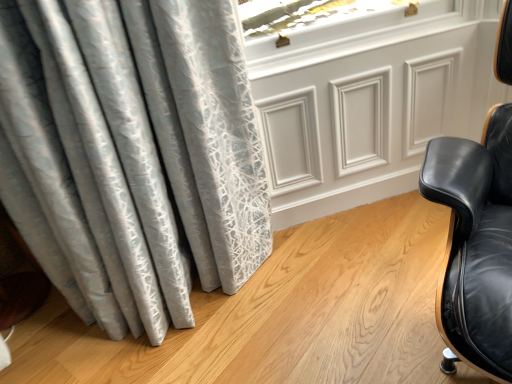
Find the location of a particular element. This screenshot has width=512, height=384. free point above white glossy panel at upper center (from a real-world perspective) is located at coordinates coord(362,48).